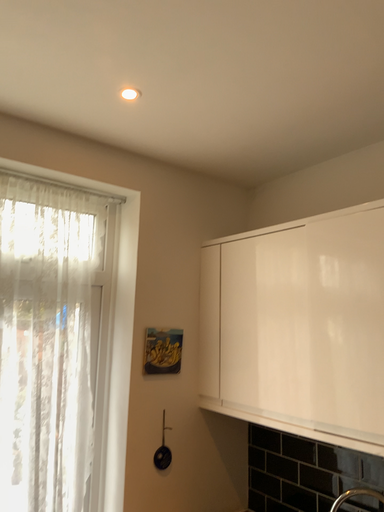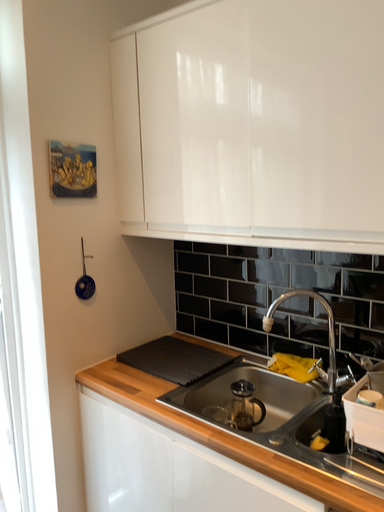
Question: Which way did the camera rotate in the video?

Choices:
 (A) rotated right
 (B) rotated left

Answer: (A)